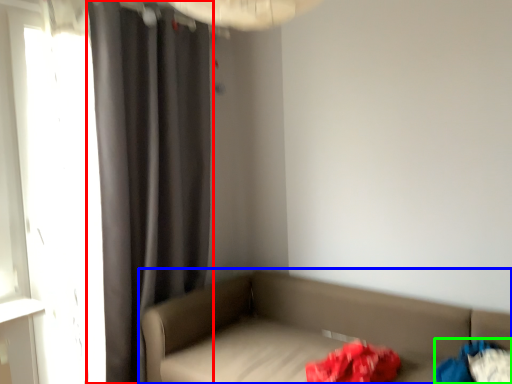
Question: Based on their relative distances, which object is farther from curtain (highlighted by a red box)? Choose from studio couch (highlighted by a blue box) and clothing (highlighted by a green box).

Choices:
 (A) studio couch
 (B) clothing

Answer: (B)